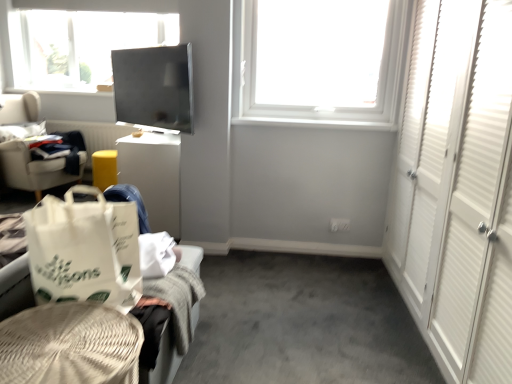
Describe the element at coordinates (84, 250) in the screenshot. The image size is (512, 384). I see `white paper shopping bag at lower left` at that location.

You are a GUI agent. You are given a task and a screenshot of the screen. Output one action in this format:
    pyautogui.click(x=<x>, y=<y>)
    Task: Click on the woven beige basket at lower left, marked as the 1th furniture in a front-to-back arrangement
    This screenshot has height=384, width=512.
    Given the screenshot: What is the action you would take?
    pyautogui.click(x=70, y=345)

Is white paper shopping bag at lower left not close to light gray fabric chair at left?

white paper shopping bag at lower left is positioned a significant distance from light gray fabric chair at left.

Which is in front, point (93, 297) or point (23, 161)?

The point (93, 297) is closer.

From the picture: Which object is further away from the camera, white paper shopping bag at lower left or light gray fabric chair at left?

light gray fabric chair at left.

Considering the relative sizes of white paper shopping bag at lower left and light gray fabric chair at left in the image provided, is white paper shopping bag at lower left smaller than light gray fabric chair at left?

Yes, white paper shopping bag at lower left is smaller than light gray fabric chair at left.

Is white woven basket at lower left, the first furniture positioned from the back, not inside white paper shopping bag at lower left?

Yes.

Is white woven basket at lower left, the first furniture positioned from the back, aimed at white paper shopping bag at lower left?

No.

Is white woven basket at lower left, the first furniture positioned from the back, further to the viewer compared to matte black screen at upper center?

No, white woven basket at lower left, the first furniture positioned from the back, is in front of matte black screen at upper center.

Is matte black screen at upper center located within white woven basket at lower left, the 2th furniture positioned from the front?

Definitely not — matte black screen at upper center is not inside white woven basket at lower left, the 2th furniture positioned from the front.

Based on the photo, from the image's perspective, is white woven basket at lower left, the 2th furniture positioned from the front, above matte black screen at upper center?

Actually, white woven basket at lower left, the 2th furniture positioned from the front, appears below matte black screen at upper center in the image.

Consider the image. Is white woven basket at lower left, the 2th furniture positioned from the front, looking in the opposite direction of matte black screen at upper center?

white woven basket at lower left, the 2th furniture positioned from the front, is not turned away from matte black screen at upper center.

Is matte black screen at upper center placed right next to white woven basket at lower left, the 2th furniture positioned from the front?

No, matte black screen at upper center is not next to white woven basket at lower left, the 2th furniture positioned from the front.

Based on the photo, is matte black screen at upper center bigger than white woven basket at lower left, the 2th furniture positioned from the front?

No, matte black screen at upper center is not bigger than white woven basket at lower left, the 2th furniture positioned from the front.

The height and width of the screenshot is (384, 512). Find the location of `window screen located on the left of white woven basket at lower left, the first furniture positioned from the back`. window screen located on the left of white woven basket at lower left, the first furniture positioned from the back is located at coordinates (154, 87).

Is light gray fabric chair at left oriented towards matte black screen at upper center?

Yes, light gray fabric chair at left is aimed at matte black screen at upper center.

From the image's perspective, which one is positioned higher, light gray fabric chair at left or matte black screen at upper center?

matte black screen at upper center appears higher in the image.

Considering the positions of point (10, 174) and point (128, 109), is point (10, 174) closer or farther from the camera than point (128, 109)?

Point (10, 174) is positioned farther from the camera compared to point (128, 109).

Is white cardboard box at center-left at the back of light gray fabric chair at left?

No, white cardboard box at center-left is not at the back of light gray fabric chair at left.

From the image's perspective, which object appears higher, light gray fabric chair at left or white cardboard box at center-left?

light gray fabric chair at left is shown above in the image.

From a real-world perspective, is light gray fabric chair at left located beneath white cardboard box at center-left?

No, from a real-world perspective, light gray fabric chair at left is not under white cardboard box at center-left.

Which object is positioned more to the left, light gray fabric chair at left or white cardboard box at center-left?

light gray fabric chair at left.

From a real-world perspective, is white woven basket at lower left, the first furniture positioned from the back, located higher than woven beige basket at lower left, acting as the 2th furniture starting from the back?

Yes, from a real-world perspective, white woven basket at lower left, the first furniture positioned from the back, is on top of woven beige basket at lower left, acting as the 2th furniture starting from the back.

Would you say woven beige basket at lower left, marked as the 1th furniture in a front-to-back arrangement, is part of white woven basket at lower left, the 2th furniture positioned from the front,'s contents?

No, woven beige basket at lower left, marked as the 1th furniture in a front-to-back arrangement, is not surrounded by white woven basket at lower left, the 2th furniture positioned from the front.

From the image's perspective, is white woven basket at lower left, the first furniture positioned from the back, positioned above or below woven beige basket at lower left, marked as the 1th furniture in a front-to-back arrangement?

white woven basket at lower left, the first furniture positioned from the back, is situated higher than woven beige basket at lower left, marked as the 1th furniture in a front-to-back arrangement, in the image.

The image size is (512, 384). Find the location of `chair behind the white paper shopping bag at lower left`. chair behind the white paper shopping bag at lower left is located at coordinates (34, 169).

From a real-world perspective, starting from the white paper shopping bag at lower left, which furniture is the 1st one below it? Please provide its 2D coordinates.

[(13, 285)]

Considering their positions, is white cardboard box at center-left positioned closer to light gray fabric chair at left than white woven basket at lower left, the first furniture positioned from the back?

white cardboard box at center-left.

When comparing their distances from woven beige basket at lower left, acting as the 2th furniture starting from the back, does light gray fabric chair at left or white paper shopping bag at lower left seem further?

light gray fabric chair at left.

When comparing their distances from white cardboard box at center-left, does matte black screen at upper center or light gray fabric chair at left seem closer?

matte black screen at upper center is closer to white cardboard box at center-left.

Considering their positions, is white woven basket at lower left, the 2th furniture positioned from the front, positioned closer to matte black screen at upper center than light gray fabric chair at left?

The object closer to matte black screen at upper center is white woven basket at lower left, the 2th furniture positioned from the front.

When comparing their distances from light gray fabric chair at left, does white woven basket at lower left, the first furniture positioned from the back, or white cardboard box at center-left seem closer?

white cardboard box at center-left lies closer to light gray fabric chair at left than the other object.

Based on their spatial positions, is white cardboard box at center-left or white paper shopping bag at lower left closer to light gray fabric chair at left?

white cardboard box at center-left is closer to light gray fabric chair at left.

Based on the photo, looking at the image, which one is located further to white paper shopping bag at lower left, white woven basket at lower left, the first furniture positioned from the back, or woven beige basket at lower left, acting as the 2th furniture starting from the back?

white woven basket at lower left, the first furniture positioned from the back, is positioned further to the anchor white paper shopping bag at lower left.

Estimate the real-world distances between objects in this image. Which object is further from woven beige basket at lower left, acting as the 2th furniture starting from the back, white woven basket at lower left, the first furniture positioned from the back, or matte black screen at upper center?

matte black screen at upper center is positioned further to the anchor woven beige basket at lower left, acting as the 2th furniture starting from the back.

Identify the location of desk between light gray fabric chair at left and white plastic window at upper center in the horizontal direction. (153, 176).

This screenshot has height=384, width=512. I want to click on window screen positioned between woven beige basket at lower left, marked as the 1th furniture in a front-to-back arrangement, and white cardboard box at center-left from near to far, so click(154, 87).

Locate an element on the screen. The width and height of the screenshot is (512, 384). window screen between white plastic window at upper center and white woven basket at lower left, the 2th furniture positioned from the front, from top to bottom is located at coordinates (154, 87).

Where is `furniture between white paper shopping bag at lower left and light gray fabric chair at left along the z-axis`? Image resolution: width=512 pixels, height=384 pixels. furniture between white paper shopping bag at lower left and light gray fabric chair at left along the z-axis is located at coordinates (13, 285).